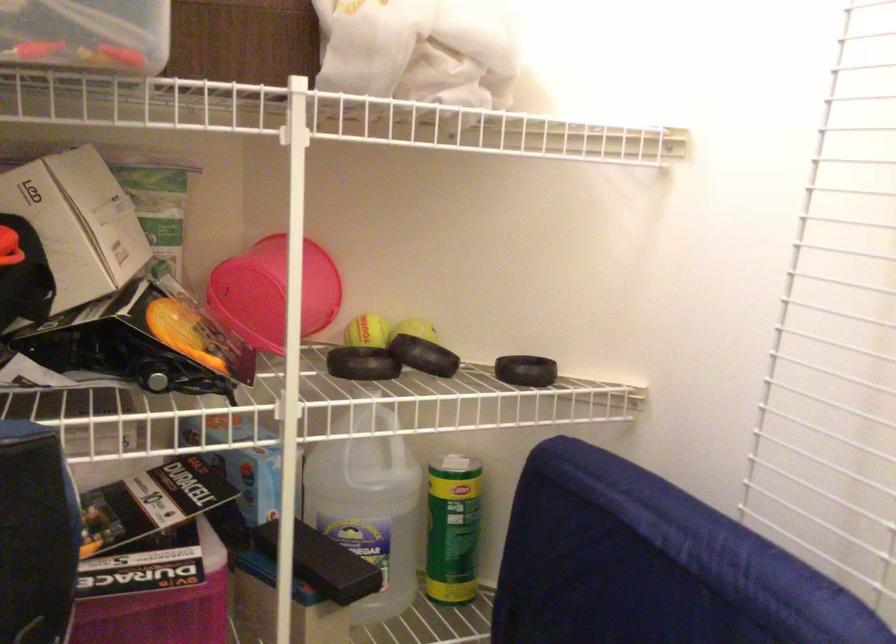
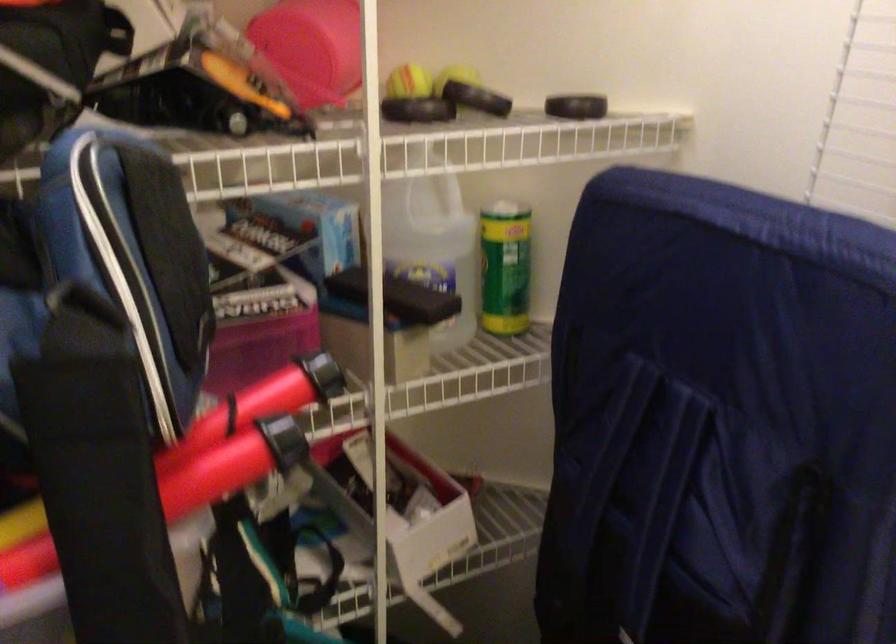
The point at (428, 366) is marked in the first image. Where is the corresponding point in the second image?

(487, 100)